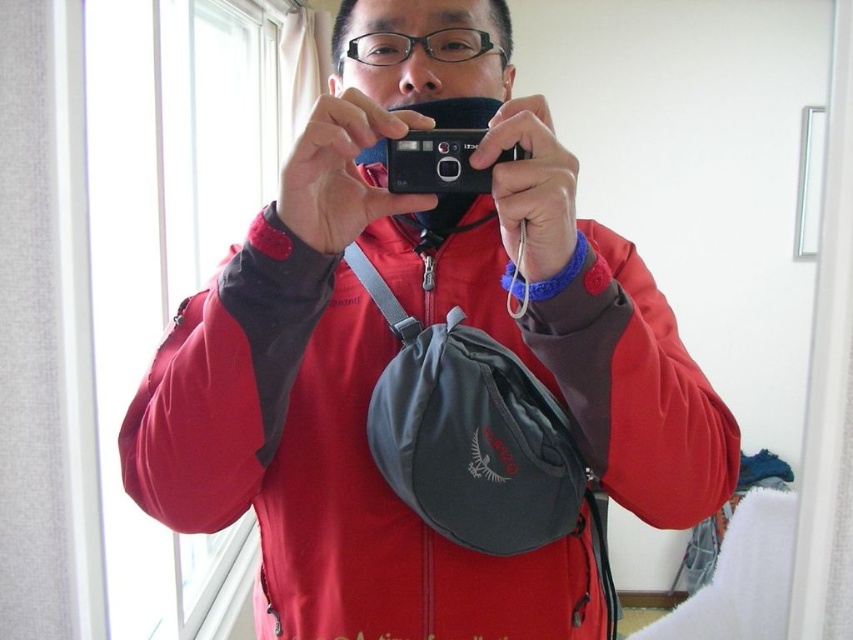
Question: Does matte red jacket at center appear under black plastic camera at center?

Choices:
 (A) no
 (B) yes

Answer: (B)

Question: Is matte red jacket at center thinner than black plastic camera at center?

Choices:
 (A) yes
 (B) no

Answer: (B)

Question: Does matte red jacket at center appear under black plastic camera at center?

Choices:
 (A) yes
 (B) no

Answer: (A)

Question: Which of the following is the farthest from the observer?

Choices:
 (A) black plastic camera at center
 (B) matte red jacket at center

Answer: (A)